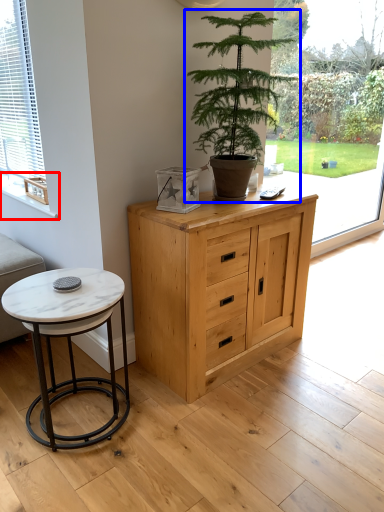
Question: Which of the following is the closest to the observer, window sill (highlighted by a red box) or houseplant (highlighted by a blue box)?

Choices:
 (A) window sill
 (B) houseplant

Answer: (B)